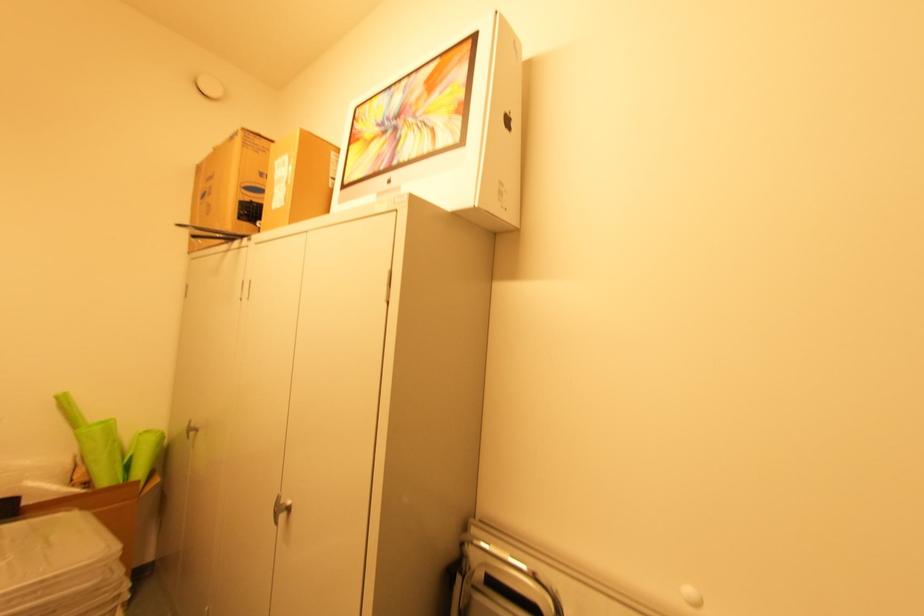
At what (x,y) coordinates should I click in order to perform the action: click on folded metal chair. Please return your answer as a coordinate pair (x, y). This screenshot has width=924, height=616. Looking at the image, I should click on (499, 584).